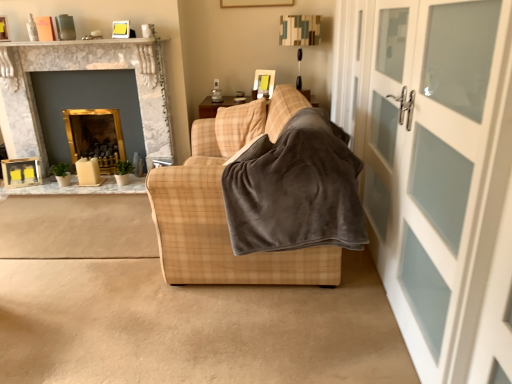
Question: Does white frosted glass door at right have a lesser height compared to plaid fabric couch at center?

Choices:
 (A) no
 (B) yes

Answer: (A)

Question: Considering the relative positions of white frosted glass door at right and plaid fabric couch at center in the image provided, is white frosted glass door at right to the right of plaid fabric couch at center from the viewer's perspective?

Choices:
 (A) no
 (B) yes

Answer: (B)

Question: Does white frosted glass door at right have a larger size compared to plaid fabric couch at center?

Choices:
 (A) no
 (B) yes

Answer: (A)

Question: Considering the relative sizes of white frosted glass door at right and plaid fabric couch at center in the image provided, is white frosted glass door at right taller than plaid fabric couch at center?

Choices:
 (A) yes
 (B) no

Answer: (A)

Question: Is white frosted glass door at right thinner than plaid fabric couch at center?

Choices:
 (A) yes
 (B) no

Answer: (A)

Question: Is white frosted glass door at right located outside plaid fabric couch at center?

Choices:
 (A) yes
 (B) no

Answer: (A)

Question: Considering the relative sizes of gray fleece blanket at center and white frosted glass door at right in the image provided, is gray fleece blanket at center shorter than white frosted glass door at right?

Choices:
 (A) no
 (B) yes

Answer: (B)

Question: Is gray fleece blanket at center outside of white frosted glass door at right?

Choices:
 (A) yes
 (B) no

Answer: (A)

Question: Considering the relative sizes of gray fleece blanket at center and white frosted glass door at right in the image provided, is gray fleece blanket at center wider than white frosted glass door at right?

Choices:
 (A) no
 (B) yes

Answer: (B)

Question: Can you confirm if gray fleece blanket at center is positioned to the left of white frosted glass door at right?

Choices:
 (A) no
 (B) yes

Answer: (B)

Question: Can you confirm if gray fleece blanket at center is bigger than white frosted glass door at right?

Choices:
 (A) yes
 (B) no

Answer: (A)

Question: Considering the relative sizes of gray fleece blanket at center and white frosted glass door at right in the image provided, is gray fleece blanket at center taller than white frosted glass door at right?

Choices:
 (A) yes
 (B) no

Answer: (B)

Question: Is gray fleece blanket at center positioned with its back to plaid fabric couch at center?

Choices:
 (A) no
 (B) yes

Answer: (B)